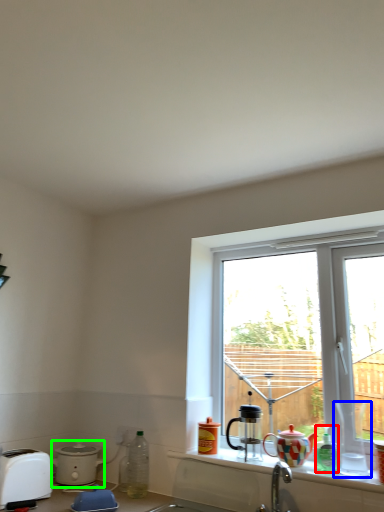
Question: Estimate the real-world distances between objects in this image. Which object is farther from bottle (highlighted by a red box), coffee cup (highlighted by a blue box) or kitchen appliance (highlighted by a green box)?

Choices:
 (A) coffee cup
 (B) kitchen appliance

Answer: (B)